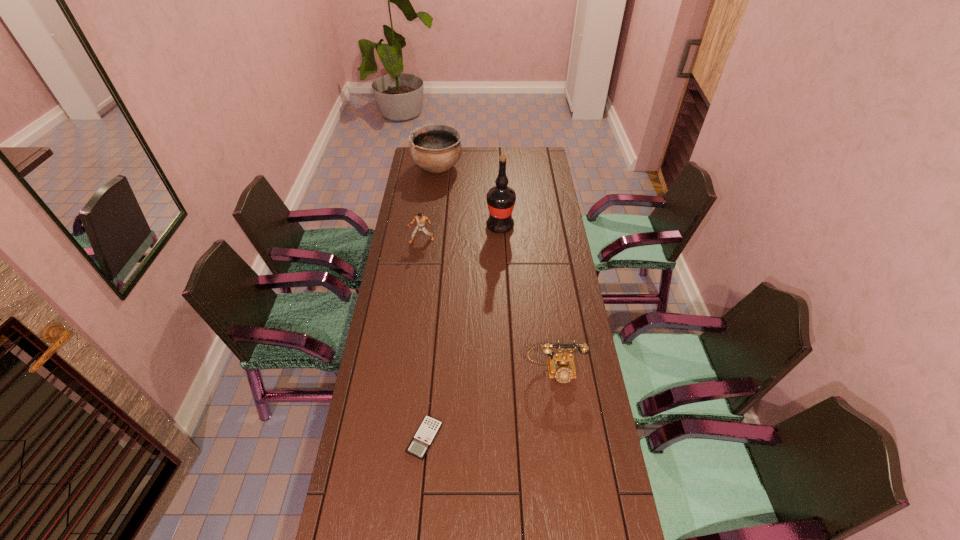
You are a GUI agent. You are given a task and a screenshot of the screen. Output one action in this format:
    pyautogui.click(x=<x>, y=<y>)
    Task: Click on the free space that is in between the tallest object and the fourth farthest object
    Image resolution: width=960 pixels, height=540 pixels.
    Given the screenshot: What is the action you would take?
    pyautogui.click(x=527, y=299)

Locate an element on the screen. object that is the closest to the wine bottle is located at coordinates (421, 220).

The height and width of the screenshot is (540, 960). In order to click on object that ranks as the fourth closest to the second nearest object in this screenshot , I will do `click(435, 148)`.

What are the coordinates of `free location that satisfies the following two spatial constraints: 1. on the front-facing side of the puncher; 2. on the left side of the calculator` in the screenshot? It's located at (394, 438).